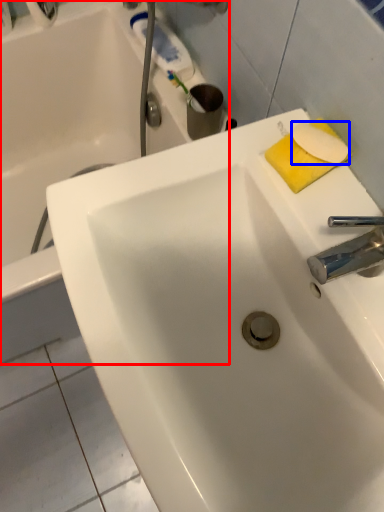
Question: Which of the following is the farthest to the observer, bathtub (highlighted by a red box) or soap (highlighted by a blue box)?

Choices:
 (A) bathtub
 (B) soap

Answer: (A)